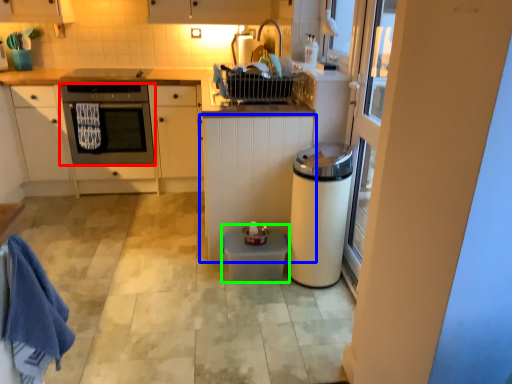
Question: Considering the real-world distances, which object is closest to home appliance (highlighted by a red box)? cabinetry (highlighted by a blue box) or water heater (highlighted by a green box).

Choices:
 (A) cabinetry
 (B) water heater

Answer: (A)